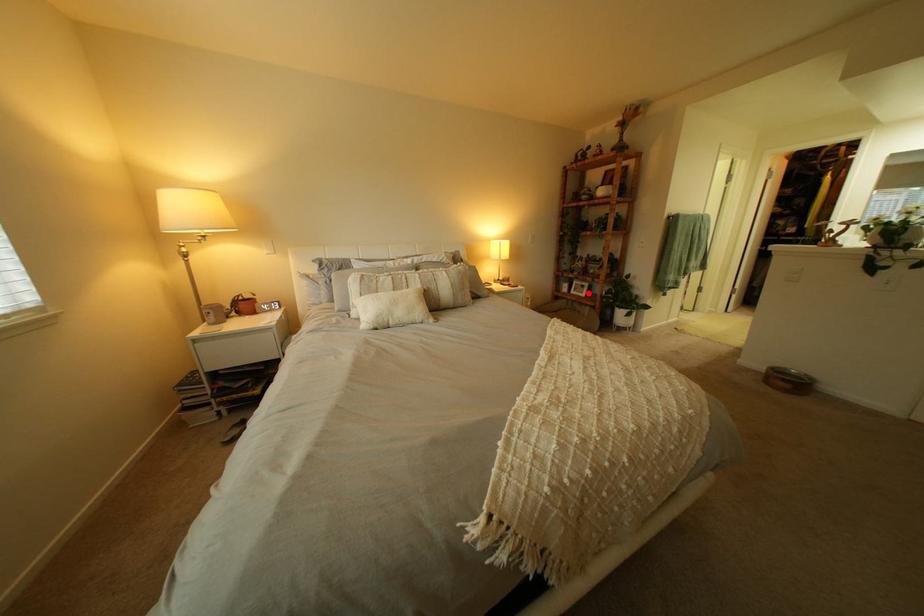
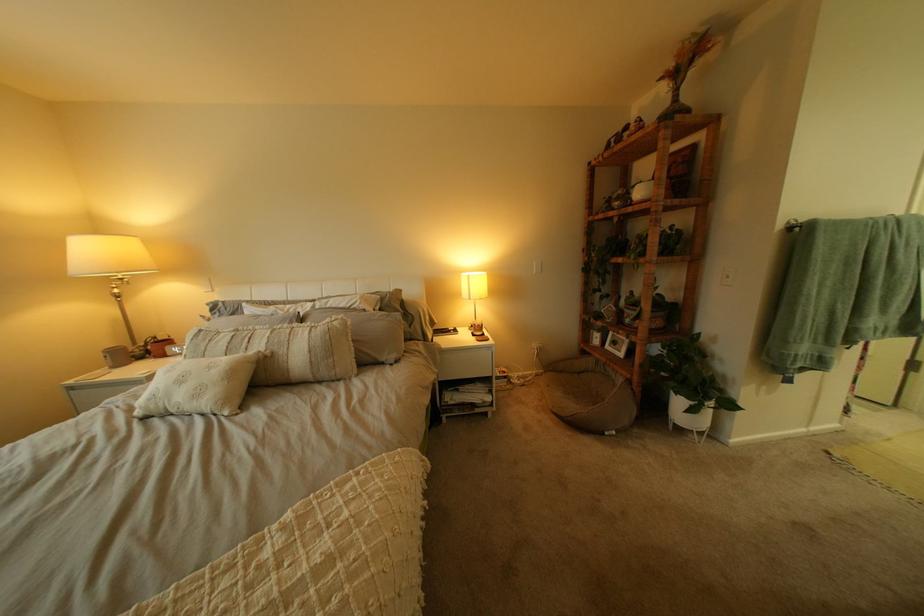
Find the pixel in the second image that matches the highlighted location in the first image.

(623, 347)